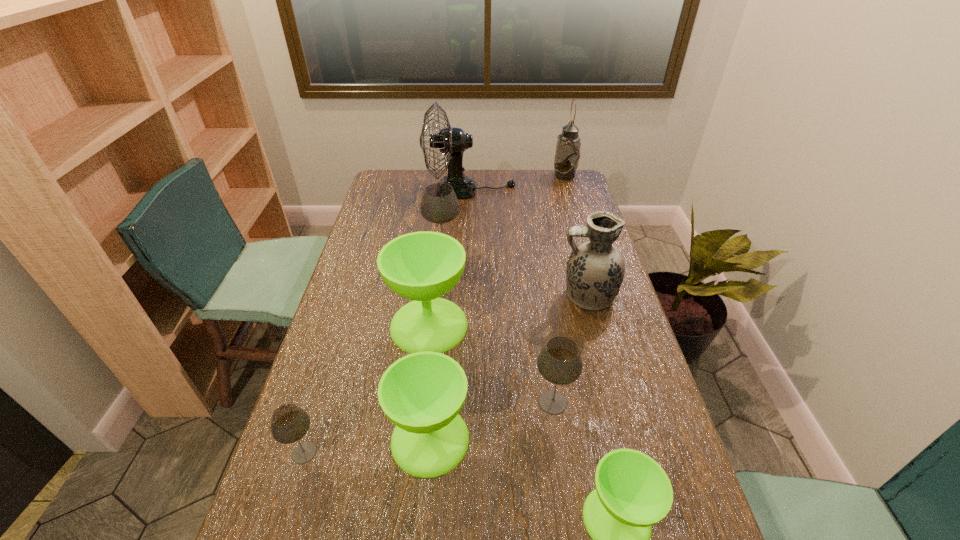
Select which gray wineglass is the closest to the blue vase. Please provide its 2D coordinates. Your answer should be formatted as a tuple, i.e. [(x, y)], where the tuple contains the x and y coordinates of a point satisfying the conditions above.

[(559, 362)]

Where is `gray wineglass that is the second closest to the rightmost gray wineglass`? The height and width of the screenshot is (540, 960). gray wineglass that is the second closest to the rightmost gray wineglass is located at coordinates (439, 204).

Where is `green wineglass object that ranks as the second closest to the rightmost gray wineglass`? green wineglass object that ranks as the second closest to the rightmost gray wineglass is located at coordinates (422, 393).

Select which green wineglass appears as the second closest to the oil lamp. Please provide its 2D coordinates. Your answer should be formatted as a tuple, i.e. [(x, y)], where the tuple contains the x and y coordinates of a point satisfying the conditions above.

[(422, 393)]

Locate an element on the screen. This screenshot has height=540, width=960. vacant space that satisfies the following two spatial constraints: 1. in front of the black fan, indicating the direction of air flow; 2. with the handle on the side of the blue vase is located at coordinates (467, 296).

Locate an element on the screen. The width and height of the screenshot is (960, 540). free location that satisfies the following two spatial constraints: 1. with the handle on the side of the blue vase; 2. on the back side of the oil lamp is located at coordinates (555, 176).